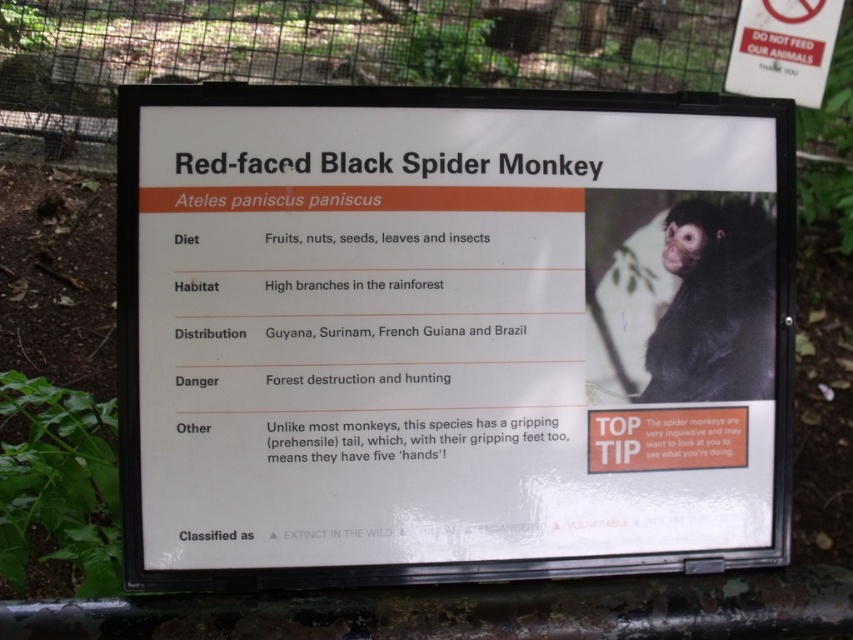
You are standing in front of the signboard and want to read both the white plastic sign at center and the black furry monkey at upper right. Which one is taller?

The white plastic sign at center is much taller than the black furry monkey at upper right.